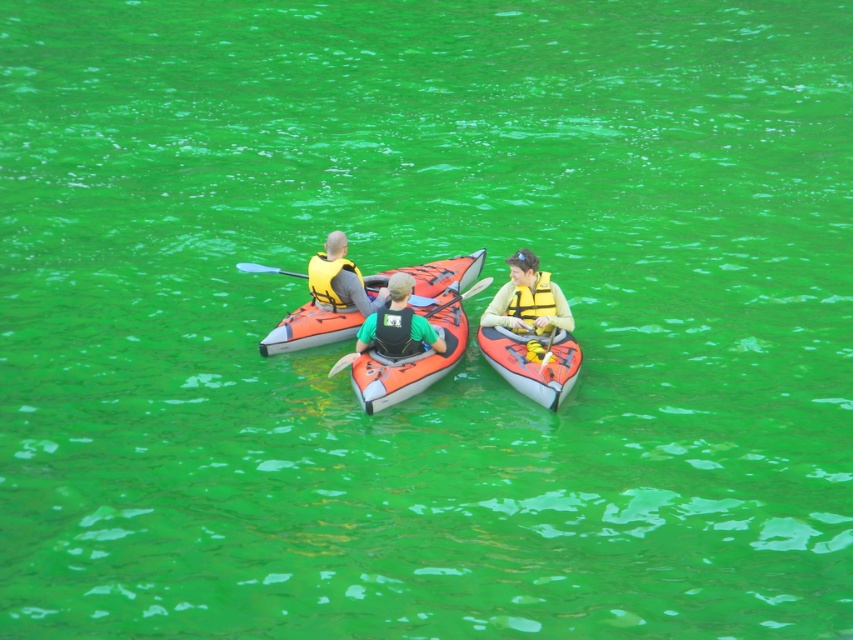
You are navigating a kayak in the middle of the bright green water. You see two points marked on your GPS map at coordinates point [473,269] and point [543,353]. Which point should you head towards if you want to reach the one that is closer to your current position?

Point [543,353] is closer to your current position because point [473,269] is behind it.

Looking at this image, you are a photographer trying to capture the orange rubber canoe at center in your shot. The camera has a focus point at coordinates 0.5, 0.36. Will the canoe be in focus?

The orange rubber canoe at center is located at point (309, 330), which is very close to the camera focus point at (306, 320). Therefore, the canoe will be in focus.